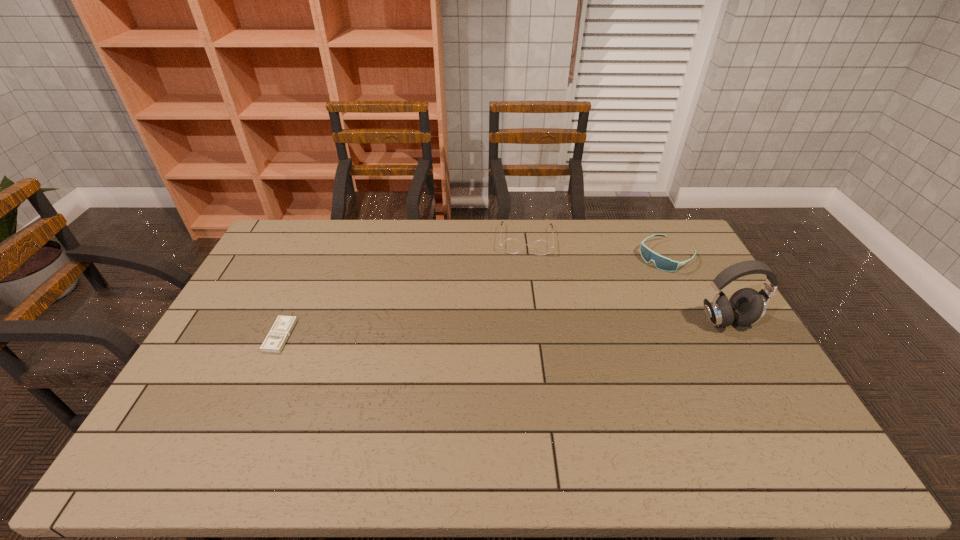
In the image, there is a desktop. Identify the location of free space at the near edge. (678, 419).

In the image, there is a desktop. In order to click on vacant region at the left edge in this screenshot , I will do `click(272, 327)`.

Where is `vacant area at the right edge of the desktop`? The width and height of the screenshot is (960, 540). vacant area at the right edge of the desktop is located at coordinates (695, 260).

I want to click on free region at the far left corner of the desktop, so click(314, 238).

You are a GUI agent. You are given a task and a screenshot of the screen. Output one action in this format:
    pyautogui.click(x=<x>, y=<y>)
    Task: Click on the vacant space at the near left corner of the desktop
    
    Given the screenshot: What is the action you would take?
    tap(221, 410)

The width and height of the screenshot is (960, 540). Find the location of `vacant area between the leftmost object and the goggles`. vacant area between the leftmost object and the goggles is located at coordinates (473, 296).

Find the location of `free point between the spectacles and the goggles`. free point between the spectacles and the goggles is located at coordinates 596,248.

I want to click on vacant space that is in between the spectacles and the headset, so click(x=626, y=280).

You are a GUI agent. You are given a task and a screenshot of the screen. Output one action in this format:
    pyautogui.click(x=<x>, y=<y>)
    Task: Click on the free spot between the goggles and the headset
    This screenshot has height=540, width=960.
    Given the screenshot: What is the action you would take?
    pyautogui.click(x=697, y=288)

The image size is (960, 540). In order to click on free space between the second object from left to right and the tallest object in this screenshot , I will do `click(626, 280)`.